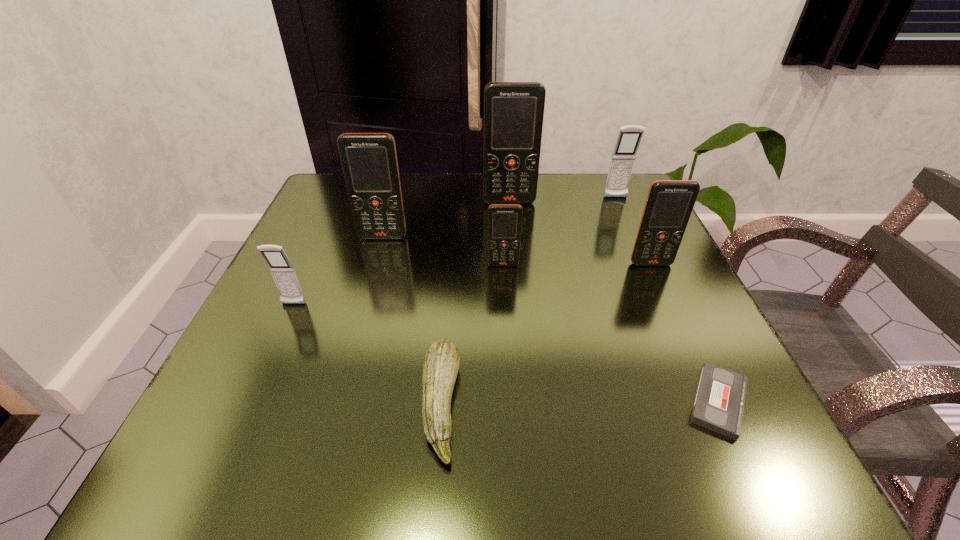
Where is `free space at the far left corner of the desktop`? The width and height of the screenshot is (960, 540). free space at the far left corner of the desktop is located at coordinates (345, 221).

In the image, there is a desktop. Identify the location of vacant space at the near left corner. (291, 481).

Where is `unoccupied area between the shortest object and the bigger gray cellular telephone`? This screenshot has height=540, width=960. unoccupied area between the shortest object and the bigger gray cellular telephone is located at coordinates (667, 300).

What are the coordinates of `free space that is in between the shortest object and the third object from left to right` in the screenshot? It's located at (580, 403).

The width and height of the screenshot is (960, 540). Find the location of `free point between the videotape and the seventh object from right to left`. free point between the videotape and the seventh object from right to left is located at coordinates (551, 319).

In order to click on vacant area that lies between the nearer gray cellular telephone and the smallest orange cellular telephone in this screenshot , I will do `click(398, 285)`.

Where is `free space between the third biggest orange cellular telephone and the bigger gray cellular telephone`? This screenshot has height=540, width=960. free space between the third biggest orange cellular telephone and the bigger gray cellular telephone is located at coordinates (634, 231).

Where is `vacant space that's between the farther gray cellular telephone and the shortest object`? This screenshot has width=960, height=540. vacant space that's between the farther gray cellular telephone and the shortest object is located at coordinates (667, 300).

Identify which object is located as the fourth nearest to the tallest cellular telephone. Please provide its 2D coordinates. Your answer should be formatted as a tuple, i.e. [(x, y)], where the tuple contains the x and y coordinates of a point satisfying the conditions above.

[(669, 204)]

Identify which object is the second nearest to the biggest orange cellular telephone. Please provide its 2D coordinates. Your answer should be formatted as a tuple, i.e. [(x, y)], where the tuple contains the x and y coordinates of a point satisfying the conditions above.

[(369, 160)]